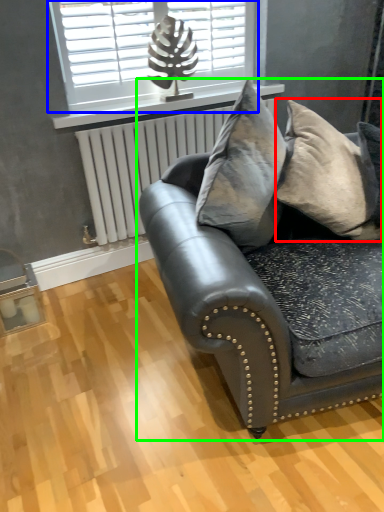
Question: Estimate the real-world distances between objects in this image. Which object is closer to pillow (highlighted by a red box), window (highlighted by a blue box) or studio couch (highlighted by a green box)?

Choices:
 (A) window
 (B) studio couch

Answer: (B)